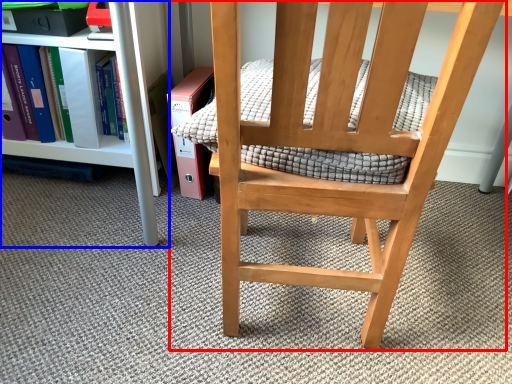
Question: Which point is further to the camera, chair (highlighted by a red box) or shelf (highlighted by a blue box)?

Choices:
 (A) chair
 (B) shelf

Answer: (B)